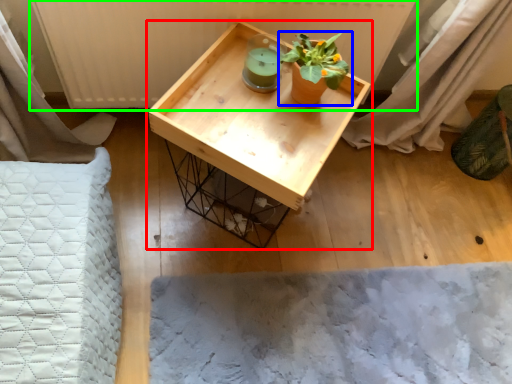
Question: Estimate the real-world distances between objects in this image. Which object is closer to table (highlighted by a red box), houseplant (highlighted by a blue box) or radiator (highlighted by a green box)?

Choices:
 (A) houseplant
 (B) radiator

Answer: (A)